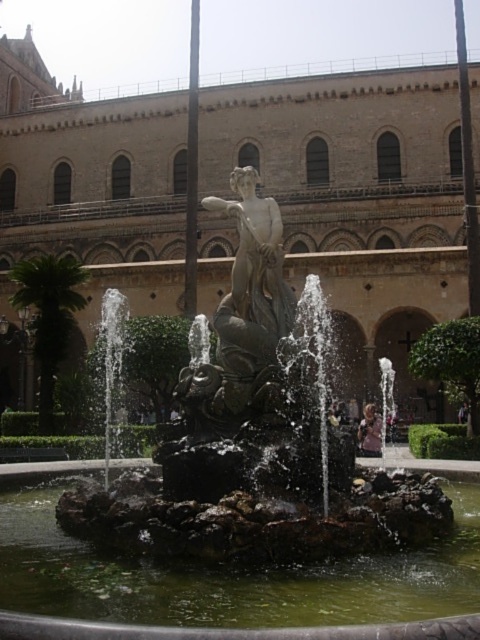
Question: Among these points, which one is farthest from the camera?

Choices:
 (A) (219, 417)
 (B) (179, 621)
 (C) (259, 221)
 (D) (139, 106)

Answer: (D)

Question: Among these objects, which one is nearest to the camera?

Choices:
 (A) brick stone palace at center
 (B) bronze statue at center

Answer: (B)

Question: Does brick stone palace at center appear on the right side of matte bronze statue at center?

Choices:
 (A) yes
 (B) no

Answer: (A)

Question: Can you confirm if brick stone palace at center is wider than green stone water at center?

Choices:
 (A) no
 (B) yes

Answer: (B)

Question: Which point is farther to the camera?

Choices:
 (A) matte bronze statue at center
 (B) bronze statue at center
 (C) green stone water at center

Answer: (A)

Question: Can you confirm if green stone water at center is smaller than matte bronze statue at center?

Choices:
 (A) no
 (B) yes

Answer: (A)